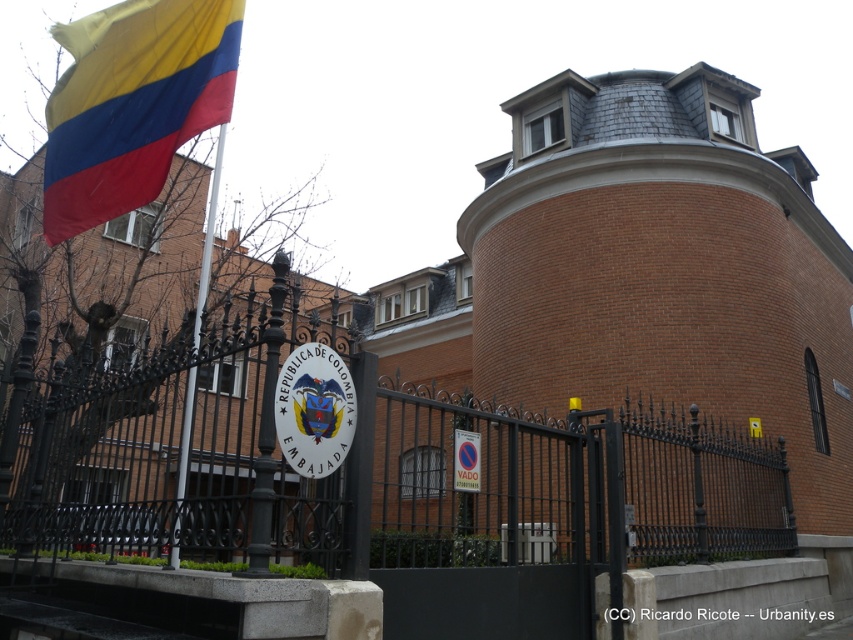
Question: Is the position of black wrought iron fence at center more distant than that of polished metal flag pole at left?

Choices:
 (A) yes
 (B) no

Answer: (B)

Question: Which point is closer to the camera?

Choices:
 (A) (160, 147)
 (B) (148, 506)

Answer: (A)

Question: Does black wrought iron fence at center appear over matte fabric flag at upper left?

Choices:
 (A) no
 (B) yes

Answer: (A)

Question: Does black wrought iron fence at center appear under polished metal flag pole at left?

Choices:
 (A) yes
 (B) no

Answer: (A)

Question: Estimate the real-world distances between objects in this image. Which object is closer to the polished metal flag pole at left?

Choices:
 (A) black wrought iron fence at center
 (B) matte fabric flag at upper left

Answer: (B)

Question: Which point is closer to the camera?

Choices:
 (A) matte fabric flag at upper left
 (B) polished metal flag pole at left

Answer: (B)